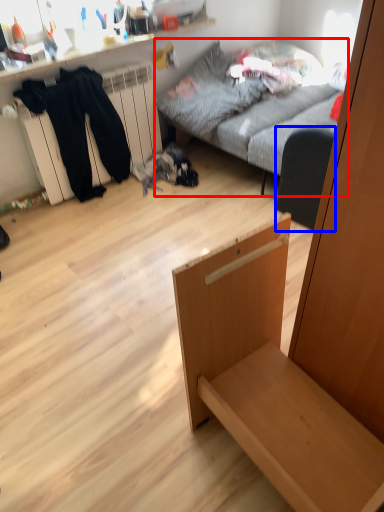
Question: Which object is closer to the camera taking this photo, studio couch (highlighted by a red box) or armchair (highlighted by a blue box)?

Choices:
 (A) studio couch
 (B) armchair

Answer: (A)